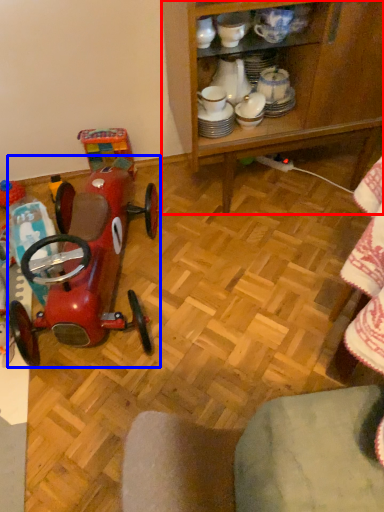
Question: Which object appears closest to the camera in this image, cabinetry (highlighted by a red box) or toy (highlighted by a blue box)?

Choices:
 (A) cabinetry
 (B) toy

Answer: (B)